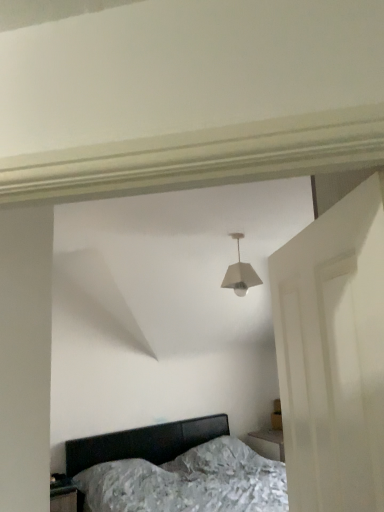
Question: Is white matte lampshade at center closer to the viewer compared to white matte door at right?

Choices:
 (A) no
 (B) yes

Answer: (A)

Question: Does white matte lampshade at center have a lesser width compared to white matte door at right?

Choices:
 (A) no
 (B) yes

Answer: (A)

Question: Is white matte lampshade at center oriented towards white matte door at right?

Choices:
 (A) no
 (B) yes

Answer: (A)

Question: Is white matte lampshade at center bigger than white matte door at right?

Choices:
 (A) no
 (B) yes

Answer: (A)

Question: Can you confirm if white matte lampshade at center is shorter than white matte door at right?

Choices:
 (A) yes
 (B) no

Answer: (A)

Question: In the image, is white matte lampshade at center on the left side or the right side of matte black bed at lower center?

Choices:
 (A) right
 (B) left

Answer: (A)

Question: Is white matte lampshade at center inside the boundaries of matte black bed at lower center, or outside?

Choices:
 (A) inside
 (B) outside

Answer: (B)

Question: Is white matte lampshade at center taller or shorter than matte black bed at lower center?

Choices:
 (A) short
 (B) tall

Answer: (A)

Question: Is white matte lampshade at center wider or thinner than matte black bed at lower center?

Choices:
 (A) wide
 (B) thin

Answer: (B)

Question: Relative to white matte lampshade at center, is white matte door at right in front or behind?

Choices:
 (A) behind
 (B) front

Answer: (B)

Question: In terms of size, does white matte door at right appear bigger or smaller than white matte lampshade at center?

Choices:
 (A) small
 (B) big

Answer: (B)

Question: Visually, is white matte door at right positioned to the left or to the right of white matte lampshade at center?

Choices:
 (A) right
 (B) left

Answer: (A)

Question: Do you think white matte door at right is within white matte lampshade at center, or outside of it?

Choices:
 (A) outside
 (B) inside

Answer: (A)

Question: In the image, is matte black bed at lower center on the left side or the right side of white matte lampshade at center?

Choices:
 (A) right
 (B) left

Answer: (B)

Question: Is matte black bed at lower center bigger or smaller than white matte lampshade at center?

Choices:
 (A) small
 (B) big

Answer: (B)